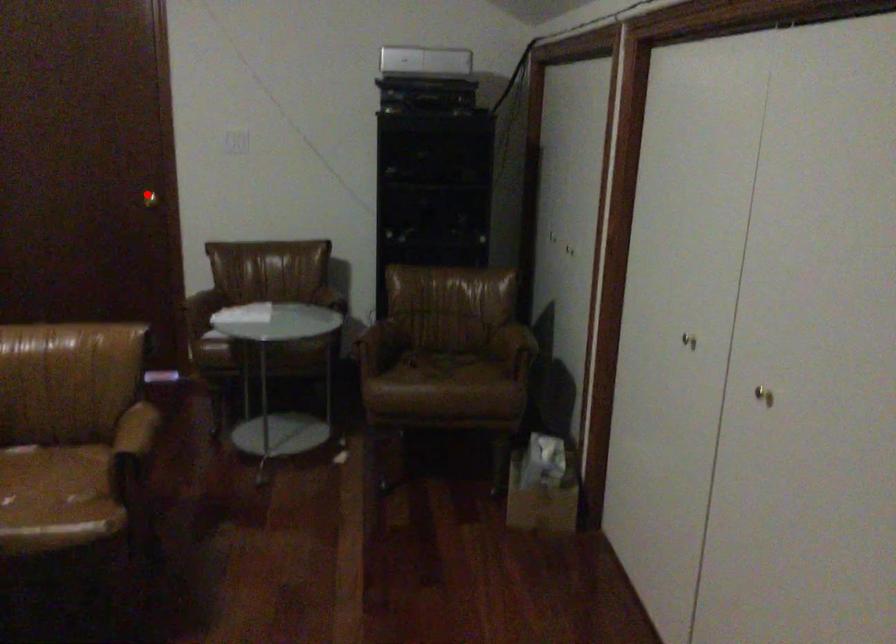
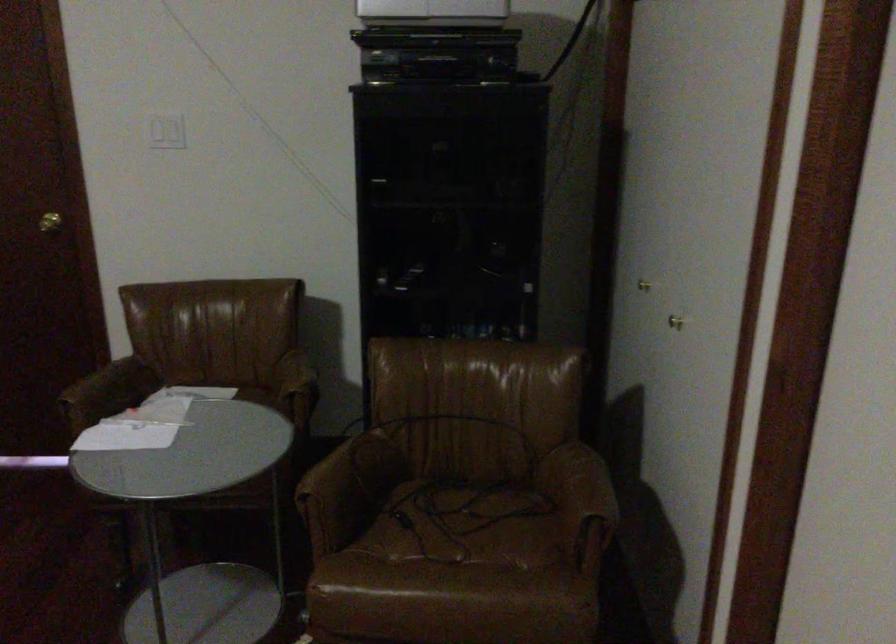
Question: I am providing you with two images of the same scene from different viewpoints. Given a red point in image1, look at the same physical point in image2. Is it:

Choices:
 (A) Closer to the viewpoint
 (B) Farther from the viewpoint

Answer: (A)